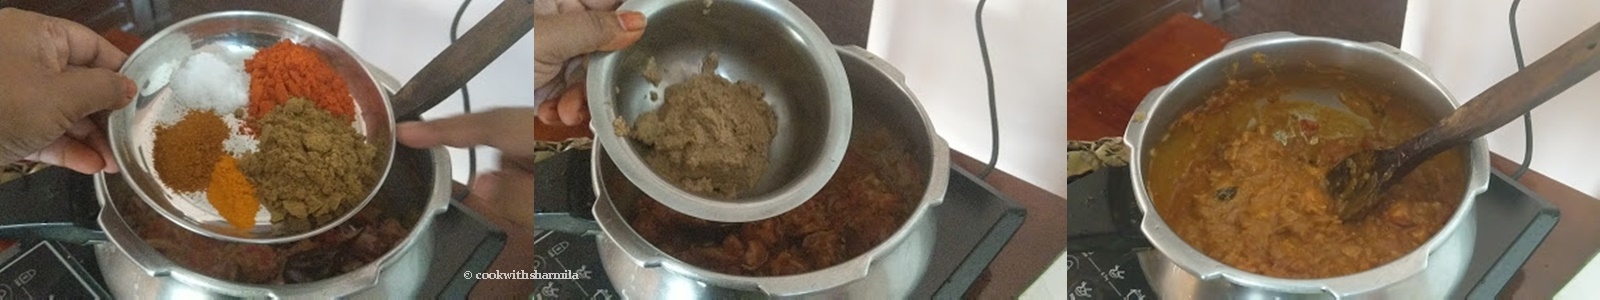
This screenshot has height=300, width=1600. In order to click on pot with food in it in this screenshot , I will do `click(390, 221)`.